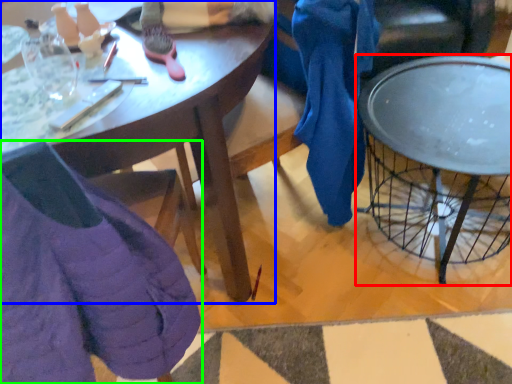
Question: Which object is positioned farthest from coffee table (highlighted by a red box)? Select from desk (highlighted by a blue box) and chair (highlighted by a green box).

Choices:
 (A) desk
 (B) chair

Answer: (B)